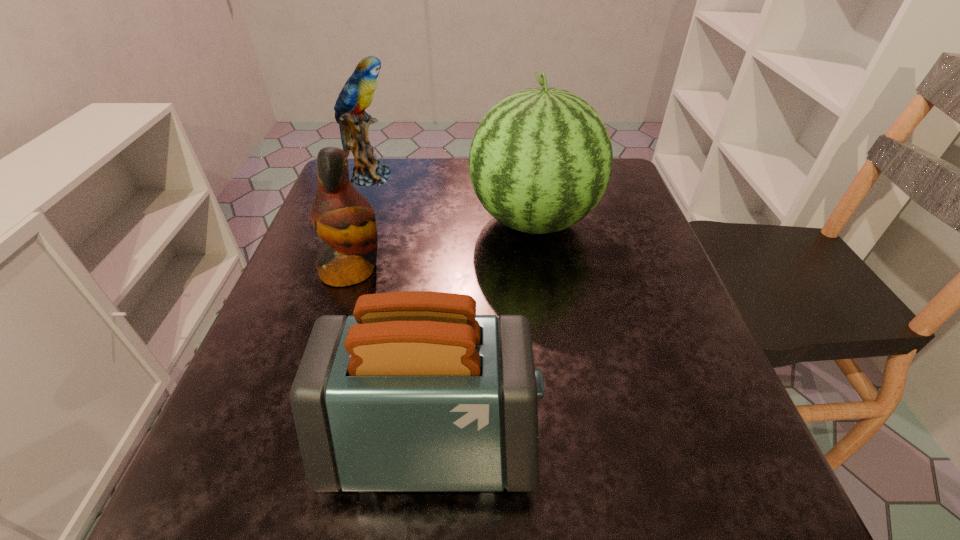
Where is `free space in the image that satisfies the following two spatial constraints: 1. on the front side of the watermelon; 2. on the front-facing side of the toaster`? free space in the image that satisfies the following two spatial constraints: 1. on the front side of the watermelon; 2. on the front-facing side of the toaster is located at coordinates (567, 442).

Locate an element on the screen. blank space that satisfies the following two spatial constraints: 1. on the face of the farther parrot; 2. on the right side of the watermelon is located at coordinates (354, 221).